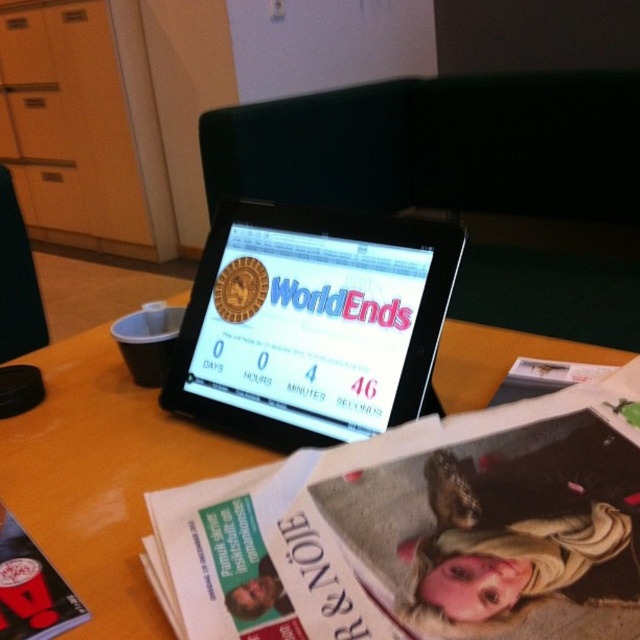
Is black glossy tablet at center thinner than wooden table at center?

Yes.

Find the location of a particular element. Image resolution: width=640 pixels, height=640 pixels. black glossy tablet at center is located at coordinates (310, 323).

Who is taller, black glossy tablet at center or matte black magazine at lower left?

black glossy tablet at center is taller.

Does black glossy tablet at center appear over matte black magazine at lower left?

Yes, black glossy tablet at center is above matte black magazine at lower left.

Locate an element on the screen. The height and width of the screenshot is (640, 640). black glossy tablet at center is located at coordinates (310, 323).

Is wooden table at center wider than matte black magazine at lower left?

Yes.

Describe the element at coordinates (100, 477) in the screenshot. Image resolution: width=640 pixels, height=640 pixels. I see `wooden table at center` at that location.

Find the location of `wooden table at center`. wooden table at center is located at coordinates pyautogui.click(x=100, y=477).